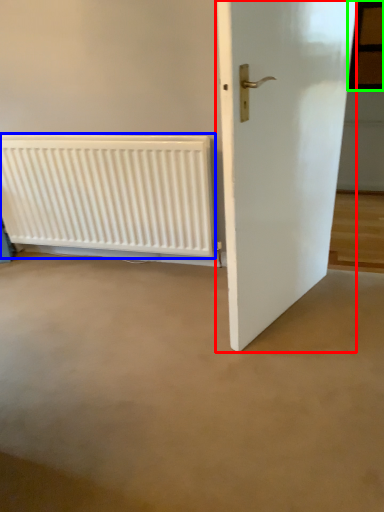
Question: Considering the real-world distances, which object is closest to door (highlighted by a red box)? radiator (highlighted by a blue box) or window (highlighted by a green box).

Choices:
 (A) radiator
 (B) window

Answer: (A)